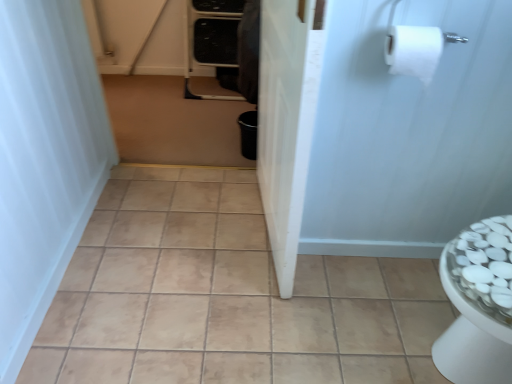
What are the coordinates of `white glossy screen door at center, acting as the first screen door starting from the left` in the screenshot? It's located at [287, 121].

Image resolution: width=512 pixels, height=384 pixels. What do you see at coordinates (44, 160) in the screenshot? I see `white matte shower curtain at left` at bounding box center [44, 160].

Where is `beige ceramic tile at center`? This screenshot has width=512, height=384. beige ceramic tile at center is located at coordinates (226, 297).

Considering the sizes of objects white matte shower curtain at left and white matte screen door at upper right, which is counted as the first screen door, starting from the right, in the image provided, who is wider, white matte shower curtain at left or white matte screen door at upper right, which is counted as the first screen door, starting from the right,?

white matte shower curtain at left.

From a real-world perspective, between white matte shower curtain at left and white matte screen door at upper right, which ranks as the 2th screen door in left-to-right order, who is vertically lower?

white matte shower curtain at left, from a real-world perspective.

Is white matte screen door at upper right, which ranks as the 2th screen door in left-to-right order, located within white matte shower curtain at left?

No, white matte screen door at upper right, which ranks as the 2th screen door in left-to-right order, is not a part of white matte shower curtain at left.

Based on their positions, is white matte shower curtain at left located to the left or right of white matte screen door at upper right, which is counted as the first screen door, starting from the right?

white matte shower curtain at left is to the left of white matte screen door at upper right, which is counted as the first screen door, starting from the right.

I want to click on toilet paper located above the beige ceramic tile at center (from the image's perspective), so click(x=413, y=51).

In the scene shown: Considering the sizes of objects beige ceramic tile at center and white matte toilet paper at upper right in the image provided, who is taller, beige ceramic tile at center or white matte toilet paper at upper right?

With more height is white matte toilet paper at upper right.

From the image's perspective, between beige ceramic tile at center and white matte toilet paper at upper right, which one is located above?

white matte toilet paper at upper right appears higher in the image.

Can you confirm if beige ceramic tile at center is bigger than white matte toilet paper at upper right?

Correct, beige ceramic tile at center is larger in size than white matte toilet paper at upper right.

Could you tell me if white matte shower curtain at left is facing beige ceramic tile at center?

Yes, white matte shower curtain at left faces towards beige ceramic tile at center.

Choose the correct answer: Is white matte shower curtain at left inside beige ceramic tile at center or outside it?

white matte shower curtain at left is outside beige ceramic tile at center.

Which object is closer to the camera taking this photo, white matte shower curtain at left or beige ceramic tile at center?

white matte shower curtain at left.

Who is shorter, brown matte trash can at center or beige ceramic tile at center?

Standing shorter between the two is brown matte trash can at center.

From the image's perspective, who appears lower, brown matte trash can at center or beige ceramic tile at center?

beige ceramic tile at center.

Is brown matte trash can at center in front of or behind beige ceramic tile at center in the image?

Clearly, brown matte trash can at center is behind beige ceramic tile at center.

Considering the positions of objects brown matte trash can at center and white matte toilet paper at upper right in the image provided, who is more to the left, brown matte trash can at center or white matte toilet paper at upper right?

Positioned to the left is brown matte trash can at center.

Does brown matte trash can at center come behind white matte toilet paper at upper right?

Yes, brown matte trash can at center is further from the viewer.

Measure the distance from brown matte trash can at center to white matte toilet paper at upper right.

brown matte trash can at center is 1.27 meters from white matte toilet paper at upper right.

From the image's perspective, between brown matte trash can at center and white matte toilet paper at upper right, which one is located above?

From the image's view, brown matte trash can at center is above.

From the image's perspective, does white glossy screen door at center, acting as the first screen door starting from the left, appear lower than white matte screen door at upper right, which is counted as the first screen door, starting from the right?

No, from the image's perspective, white glossy screen door at center, acting as the first screen door starting from the left, is not below white matte screen door at upper right, which is counted as the first screen door, starting from the right.

From a real-world perspective, is white glossy screen door at center, acting as the first screen door starting from the left, positioned under white matte screen door at upper right, which ranks as the 2th screen door in left-to-right order, based on gravity?

Actually, white glossy screen door at center, acting as the first screen door starting from the left, is physically above white matte screen door at upper right, which ranks as the 2th screen door in left-to-right order, in the real world.

Is white glossy screen door at center, acting as the first screen door starting from the left, turned away from white matte screen door at upper right, which ranks as the 2th screen door in left-to-right order?

Yes, white glossy screen door at center, acting as the first screen door starting from the left, is positioned with its back facing white matte screen door at upper right, which ranks as the 2th screen door in left-to-right order.

Considering the sizes of objects white glossy screen door at center, which is counted as the second screen door, starting from the right, and white matte screen door at upper right, which is counted as the first screen door, starting from the right, in the image provided, who is thinner, white glossy screen door at center, which is counted as the second screen door, starting from the right, or white matte screen door at upper right, which is counted as the first screen door, starting from the right,?

white matte screen door at upper right, which is counted as the first screen door, starting from the right, is thinner.

In the scene shown: Which is behind, white matte toilet paper at upper right or brown matte trash can at center?

brown matte trash can at center is further from the camera.

Is white matte toilet paper at upper right not near brown matte trash can at center?

That's right, there is a large distance between white matte toilet paper at upper right and brown matte trash can at center.

Considering the relative sizes of white matte toilet paper at upper right and brown matte trash can at center in the image provided, is white matte toilet paper at upper right thinner than brown matte trash can at center?

Yes, white matte toilet paper at upper right is thinner than brown matte trash can at center.

Where is `shower curtain that appears above the white matte screen door at upper right, which is counted as the first screen door, starting from the right (from the image's perspective)`? shower curtain that appears above the white matte screen door at upper right, which is counted as the first screen door, starting from the right (from the image's perspective) is located at coordinates (44, 160).

Locate an element on the screen. The height and width of the screenshot is (384, 512). toilet paper in front of the beige ceramic tile at center is located at coordinates (413, 51).

Considering their positions, is white matte screen door at upper right, which is counted as the first screen door, starting from the right, positioned further to brown matte trash can at center than white matte toilet paper at upper right?

white matte toilet paper at upper right is positioned further to the anchor brown matte trash can at center.

From the image, which object appears to be farther from white matte shower curtain at left, white glossy screen door at center, acting as the first screen door starting from the left, or beige ceramic tile at center?

white glossy screen door at center, acting as the first screen door starting from the left.

Looking at the image, which one is located further to brown matte trash can at center, beige ceramic tile at center or white matte toilet paper at upper right?

white matte toilet paper at upper right is positioned further to the anchor brown matte trash can at center.

Looking at the image, which one is located further to beige ceramic tile at center, white matte screen door at upper right, which is counted as the first screen door, starting from the right, or white matte shower curtain at left?

Among the two, white matte shower curtain at left is located further to beige ceramic tile at center.

Estimate the real-world distances between objects in this image. Which object is closer to beige ceramic tile at center, brown matte trash can at center or white matte toilet paper at upper right?

Among the two, brown matte trash can at center is located nearer to beige ceramic tile at center.

From the image, which object appears to be nearer to white matte toilet paper at upper right, white matte shower curtain at left or brown matte trash can at center?

white matte shower curtain at left lies closer to white matte toilet paper at upper right than the other object.

Based on their spatial positions, is white glossy screen door at center, acting as the first screen door starting from the left, or white matte shower curtain at left further from beige ceramic tile at center?

The object further to beige ceramic tile at center is white matte shower curtain at left.

Considering their positions, is beige ceramic tile at center positioned further to brown matte trash can at center than white matte screen door at upper right, which is counted as the first screen door, starting from the right?

white matte screen door at upper right, which is counted as the first screen door, starting from the right, lies further to brown matte trash can at center than the other object.

Image resolution: width=512 pixels, height=384 pixels. I want to click on toilet paper situated between white glossy screen door at center, which is counted as the second screen door, starting from the right, and white matte screen door at upper right, which ranks as the 2th screen door in left-to-right order, from left to right, so click(413, 51).

At what (x,y) coordinates should I click in order to perform the action: click on screen door situated between white matte shower curtain at left and white matte toilet paper at upper right from left to right. Please return your answer as a coordinate pair (x, y). Looking at the image, I should click on (287, 121).

Where is `toilet paper between white matte shower curtain at left and white matte screen door at upper right, which ranks as the 2th screen door in left-to-right order`? This screenshot has height=384, width=512. toilet paper between white matte shower curtain at left and white matte screen door at upper right, which ranks as the 2th screen door in left-to-right order is located at coordinates (413, 51).

At what (x,y) coordinates should I click in order to perform the action: click on toilet paper between white glossy screen door at center, which is counted as the second screen door, starting from the right, and brown matte trash can at center, along the z-axis. Please return your answer as a coordinate pair (x, y). This screenshot has height=384, width=512. Looking at the image, I should click on (413, 51).